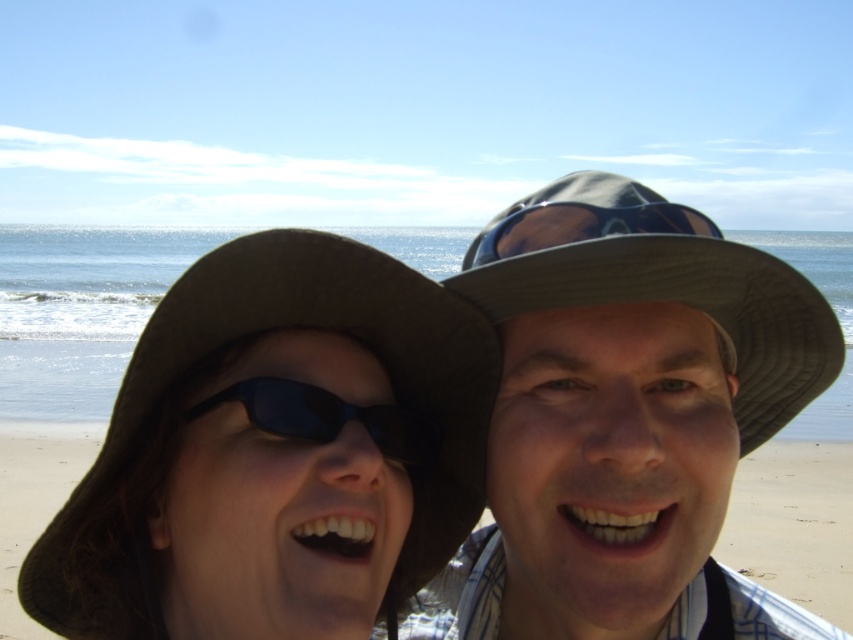
Does beige sand at center come behind black reflective sunglasses at center?

Yes.

Describe the element at coordinates (793, 524) in the screenshot. I see `beige sand at center` at that location.

In order to click on beige sand at center in this screenshot , I will do `click(793, 524)`.

You are a GUI agent. You are given a task and a screenshot of the screen. Output one action in this format:
    pyautogui.click(x=<x>, y=<y>)
    Task: Click on the beige sand at center
    The height and width of the screenshot is (640, 853).
    Given the screenshot: What is the action you would take?
    pyautogui.click(x=793, y=524)

Is brown fabric cowboy hat at left behind matte blue goggles at upper center?

No, brown fabric cowboy hat at left is closer to the viewer.

Is point (216, 348) positioned after point (592, 236)?

Yes, point (216, 348) is farther from viewer.

The height and width of the screenshot is (640, 853). I want to click on brown fabric cowboy hat at left, so click(277, 451).

Which is in front, point (602, 362) or point (212, 404)?

Point (602, 362) is more forward.

This screenshot has height=640, width=853. Describe the element at coordinates (619, 410) in the screenshot. I see `matte gray hat at center` at that location.

Does point (677, 556) come behind point (306, 385)?

That is True.

Identify the location of matte gray hat at center. The height and width of the screenshot is (640, 853). (619, 410).